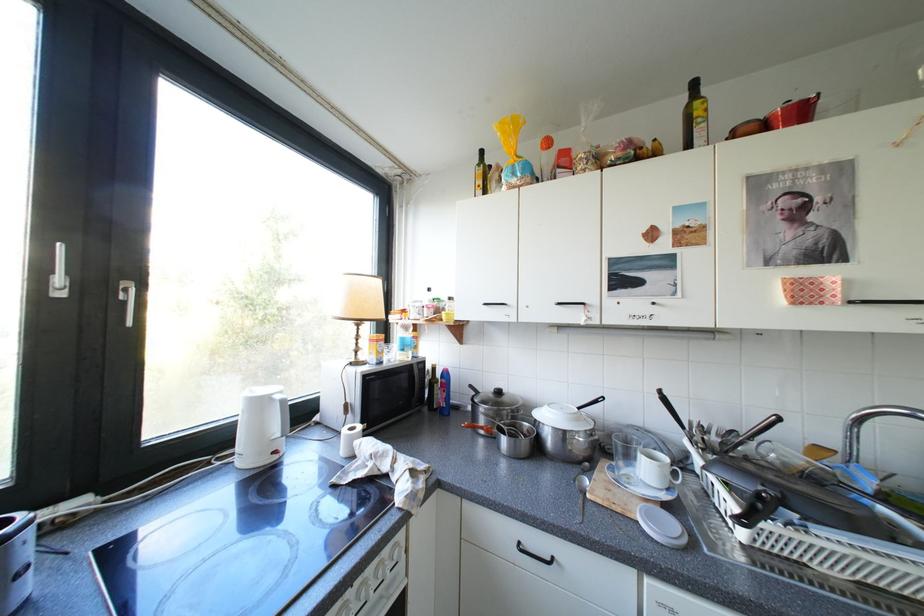
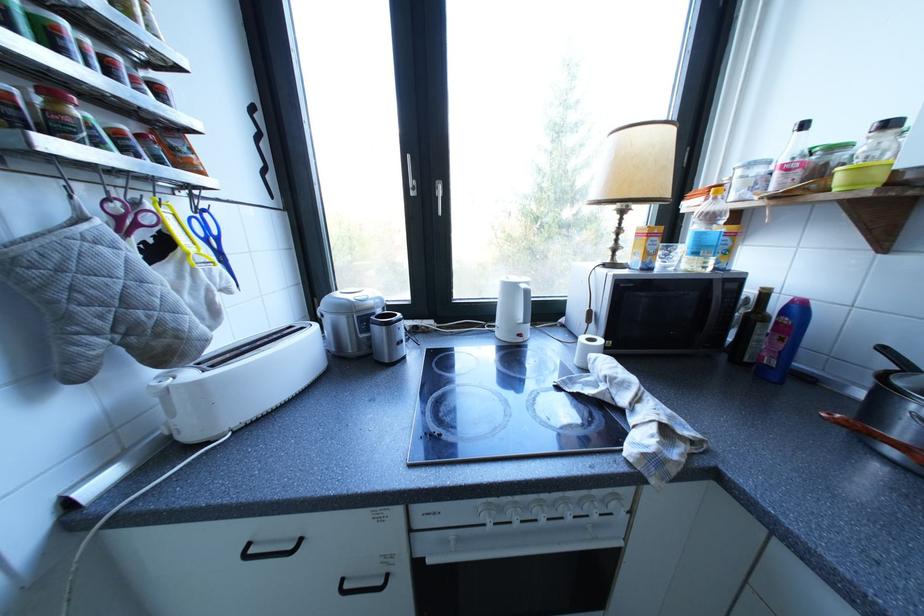
Find the pixel in the second image that matches the point at 71,294 in the first image.

(426, 193)